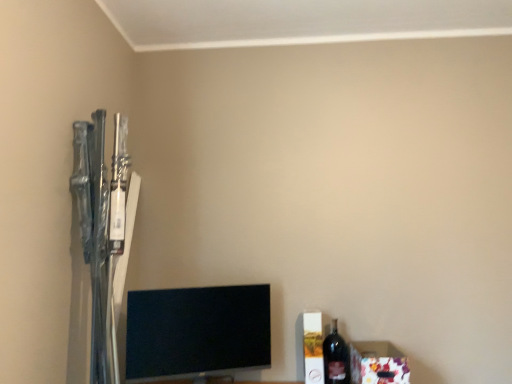
Question: In terms of height, does black glossy tv at lower center look taller or shorter compared to dark glass bottle at lower right?

Choices:
 (A) short
 (B) tall

Answer: (B)

Question: Visually, is black glossy tv at lower center positioned to the left or to the right of dark glass bottle at lower right?

Choices:
 (A) right
 (B) left

Answer: (B)

Question: Considering the real-world distances, which object is closest to the black glossy tv at lower center?

Choices:
 (A) floral paper box at lower right
 (B) dark glass bottle at lower right

Answer: (B)

Question: Estimate the real-world distances between objects in this image. Which object is closer to the black glossy tv at lower center?

Choices:
 (A) floral paper box at lower right
 (B) dark glass bottle at lower right

Answer: (B)